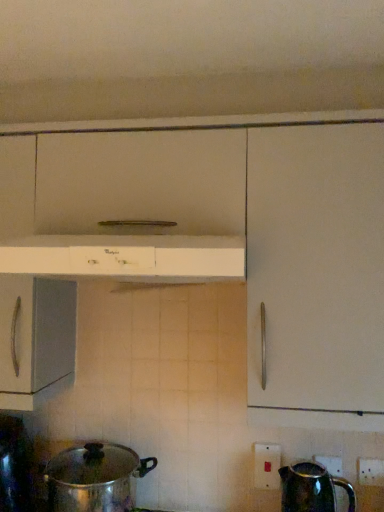
At what (x,y) coordinates should I click in order to perform the action: click on shiny metallic pot at lower left. Please return your answer as a coordinate pair (x, y). Looking at the image, I should click on (95, 478).

You are a GUI agent. You are given a task and a screenshot of the screen. Output one action in this format:
    pyautogui.click(x=<x>, y=<y>)
    Task: Click on the white plastic electric outlet at lower right, arranged as the 1th electric outlet when viewed from the left
    The width and height of the screenshot is (384, 512).
    Given the screenshot: What is the action you would take?
    pyautogui.click(x=267, y=466)

Locate an element on the screen. The image size is (384, 512). shiny metallic kettle at lower right is located at coordinates point(311,488).

From a real-world perspective, is white plastic electric outlet at lower right, which ranks as the 2th electric outlet in right-to-left order, physically below shiny metallic pot at lower left?

No, from a real-world perspective, white plastic electric outlet at lower right, which ranks as the 2th electric outlet in right-to-left order, is not beneath shiny metallic pot at lower left.

Is white plastic electric outlet at lower right, arranged as the 1th electric outlet when viewed from the left, positioned before shiny metallic pot at lower left?

No, it is not.

Is shiny metallic pot at lower left looking in the opposite direction of shiny metallic kettle at lower right?

No, shiny metallic pot at lower left is not facing away from shiny metallic kettle at lower right.

From the image's perspective, which is below, shiny metallic pot at lower left or shiny metallic kettle at lower right?

From the image's view, shiny metallic kettle at lower right is below.

From a real-world perspective, is shiny metallic pot at lower left physically above shiny metallic kettle at lower right?

Yes, from a real-world perspective, shiny metallic pot at lower left is on top of shiny metallic kettle at lower right.

Identify the location of home appliance above the shiny metallic kettle at lower right (from the image's perspective). The image size is (384, 512). (128, 257).

Could you tell me if white glossy range hood at center is turned towards shiny metallic kettle at lower right?

No, white glossy range hood at center does not turn towards shiny metallic kettle at lower right.

Considering the points (241, 272) and (308, 481), which point is behind, point (241, 272) or point (308, 481)?

The point (308, 481) is farther.

Are white glossy range hood at center and shiny metallic kettle at lower right located far from each other?

No, white glossy range hood at center is in close proximity to shiny metallic kettle at lower right.

Visually, is shiny metallic kettle at lower right positioned to the left or to the right of white glossy range hood at center?

In the image, shiny metallic kettle at lower right appears on the right side of white glossy range hood at center.

Can you tell me how much shiny metallic kettle at lower right and white glossy range hood at center differ in facing direction?

0.472 degrees separate the facing orientations of shiny metallic kettle at lower right and white glossy range hood at center.

How far apart are shiny metallic kettle at lower right and white glossy range hood at center?

shiny metallic kettle at lower right is 34.64 inches from white glossy range hood at center.

From their relative heights in the image, would you say shiny metallic kettle at lower right is taller or shorter than white glossy range hood at center?

Clearly, shiny metallic kettle at lower right is taller compared to white glossy range hood at center.

Which is correct: white plastic electric outlet at lower right, which ranks as the 2th electric outlet in right-to-left order, is inside white glossy range hood at center, or outside of it?

white plastic electric outlet at lower right, which ranks as the 2th electric outlet in right-to-left order, is outside white glossy range hood at center.

From a real-world perspective, between white plastic electric outlet at lower right, which ranks as the 2th electric outlet in right-to-left order, and white glossy range hood at center, who is vertically higher?

From a 3D spatial view, white glossy range hood at center is above.

From the image's perspective, which one is positioned lower, white plastic electric outlet at lower right, which ranks as the 2th electric outlet in right-to-left order, or white glossy range hood at center?

white plastic electric outlet at lower right, which ranks as the 2th electric outlet in right-to-left order, is shown below in the image.

How different are the orientations of white plastic electric outlet at lower right, which ranks as the 2th electric outlet in right-to-left order, and white glossy range hood at center in degrees?

The facing directions of white plastic electric outlet at lower right, which ranks as the 2th electric outlet in right-to-left order, and white glossy range hood at center are 2.03 degrees apart.

Considering the relative sizes of white plastic electric outlet at lower right, which appears as the second electric outlet when viewed from the left, and shiny metallic kettle at lower right in the image provided, is white plastic electric outlet at lower right, which appears as the second electric outlet when viewed from the left, taller than shiny metallic kettle at lower right?

In fact, white plastic electric outlet at lower right, which appears as the second electric outlet when viewed from the left, may be shorter than shiny metallic kettle at lower right.

Is point (362, 484) positioned after point (320, 472)?

No, it is in front of (320, 472).

Does white plastic electric outlet at lower right, the 1th electric outlet when ordered from right to left, lie in front of shiny metallic kettle at lower right?

No, white plastic electric outlet at lower right, the 1th electric outlet when ordered from right to left, is further to the viewer.

Which of these two, shiny metallic pot at lower left or shiny metallic pot at lower left, is wider?

With larger width is shiny metallic pot at lower left.

Can you confirm if shiny metallic pot at lower left is smaller than shiny metallic pot at lower left?

Indeed, shiny metallic pot at lower left has a smaller size compared to shiny metallic pot at lower left.

From a real-world perspective, is shiny metallic pot at lower left physically below shiny metallic pot at lower left?

Correct, in the physical world, shiny metallic pot at lower left is lower than shiny metallic pot at lower left.

I want to click on kitchen appliance below the white plastic electric outlet at lower right, which ranks as the 2th electric outlet in right-to-left order (from the image's perspective), so click(x=15, y=466).

Where is `crock pot to the left of shiny metallic kettle at lower right`? This screenshot has height=512, width=384. crock pot to the left of shiny metallic kettle at lower right is located at coordinates (95, 478).

Based on their spatial positions, is white plastic electric outlet at lower right, which ranks as the first electric outlet in back-to-front order, or shiny metallic pot at lower left closer to white plastic electric outlet at lower right, which appears as the second electric outlet when viewed from the left?

Among the two, white plastic electric outlet at lower right, which ranks as the first electric outlet in back-to-front order, is located nearer to white plastic electric outlet at lower right, which appears as the second electric outlet when viewed from the left.

Looking at the image, which one is located closer to white plastic electric outlet at lower right, which ranks as the first electric outlet in back-to-front order, shiny metallic pot at lower left or shiny metallic kettle at lower right?

shiny metallic kettle at lower right lies closer to white plastic electric outlet at lower right, which ranks as the first electric outlet in back-to-front order, than the other object.

When comparing their distances from shiny metallic kettle at lower right, does white plastic electric outlet at lower right, which appears as the second electric outlet when viewed from the left, or shiny metallic pot at lower left seem closer?

The object closer to shiny metallic kettle at lower right is white plastic electric outlet at lower right, which appears as the second electric outlet when viewed from the left.

Estimate the real-world distances between objects in this image. Which object is closer to shiny metallic kettle at lower right, white plastic electric outlet at lower right, arranged as the 1th electric outlet when viewed from the left, or shiny metallic pot at lower left?

The object closer to shiny metallic kettle at lower right is white plastic electric outlet at lower right, arranged as the 1th electric outlet when viewed from the left.

Estimate the real-world distances between objects in this image. Which object is closer to shiny metallic pot at lower left, white plastic electric outlet at lower right, which appears as the second electric outlet when viewed from the left, or shiny metallic kettle at lower right?

shiny metallic kettle at lower right lies closer to shiny metallic pot at lower left than the other object.

Which object lies nearer to the anchor point shiny metallic kettle at lower right, white plastic electric outlet at lower right, which ranks as the 2th electric outlet in right-to-left order, or shiny metallic pot at lower left?

white plastic electric outlet at lower right, which ranks as the 2th electric outlet in right-to-left order.

From the image, which object appears to be farther from shiny metallic kettle at lower right, white plastic electric outlet at lower right, which ranks as the first electric outlet in back-to-front order, or white plastic electric outlet at lower right, which appears as the second electric outlet when viewed from the left?

Among the two, white plastic electric outlet at lower right, which appears as the second electric outlet when viewed from the left, is located further to shiny metallic kettle at lower right.

Based on their spatial positions, is white plastic electric outlet at lower right, the 2th electric outlet from the back, or shiny metallic pot at lower left further from white glossy range hood at center?

Among the two, white plastic electric outlet at lower right, the 2th electric outlet from the back, is located further to white glossy range hood at center.

Identify the location of electric outlet located between shiny metallic pot at lower left and white plastic electric outlet at lower right, which appears as the second electric outlet when viewed from the left, in the left-right direction. The image size is (384, 512). (267, 466).

This screenshot has height=512, width=384. In order to click on kettle between white plastic electric outlet at lower right, arranged as the 1th electric outlet when viewed from the left, and white plastic electric outlet at lower right, which is counted as the 1th electric outlet, starting from the front in this screenshot , I will do `click(311, 488)`.

I want to click on crock pot between shiny metallic pot at lower left and white plastic electric outlet at lower right, the 1th electric outlet when ordered from right to left, in the horizontal direction, so click(95, 478).

Where is `crock pot between white glossy range hood at center and shiny metallic kettle at lower right in the vertical direction`? The height and width of the screenshot is (512, 384). crock pot between white glossy range hood at center and shiny metallic kettle at lower right in the vertical direction is located at coordinates (95, 478).